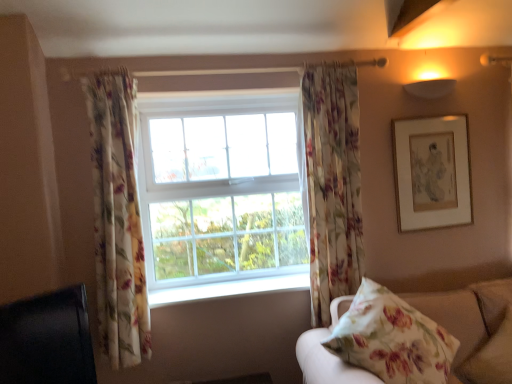
Question: Is floral fabric curtain at left, which appears as the 1th curtain when viewed from the left, in front of or behind floral fabric curtain at center, arranged as the second curtain when viewed from the left, in the image?

Choices:
 (A) front
 (B) behind

Answer: (A)

Question: Is floral fabric curtain at left, which appears as the 1th curtain when viewed from the left, spatially inside floral fabric curtain at center, arranged as the second curtain when viewed from the left, or outside of it?

Choices:
 (A) inside
 (B) outside

Answer: (B)

Question: Based on their relative distances, which object is nearer to the floral fabric curtain at center, positioned as the 1th curtain in right-to-left order?

Choices:
 (A) white smooth window sill at center
 (B) floral fabric pillow at lower right
 (C) black glossy tv at lower left
 (D) white glass window at center
 (E) floral fabric curtain at left, positioned as the second curtain in right-to-left order

Answer: (D)

Question: Considering the real-world distances, which object is farthest from the white smooth window sill at center?

Choices:
 (A) floral fabric curtain at center, arranged as the second curtain when viewed from the left
 (B) white glass window at center
 (C) floral fabric pillow at lower right
 (D) black glossy tv at lower left
 (E) floral fabric curtain at left, positioned as the second curtain in right-to-left order

Answer: (C)